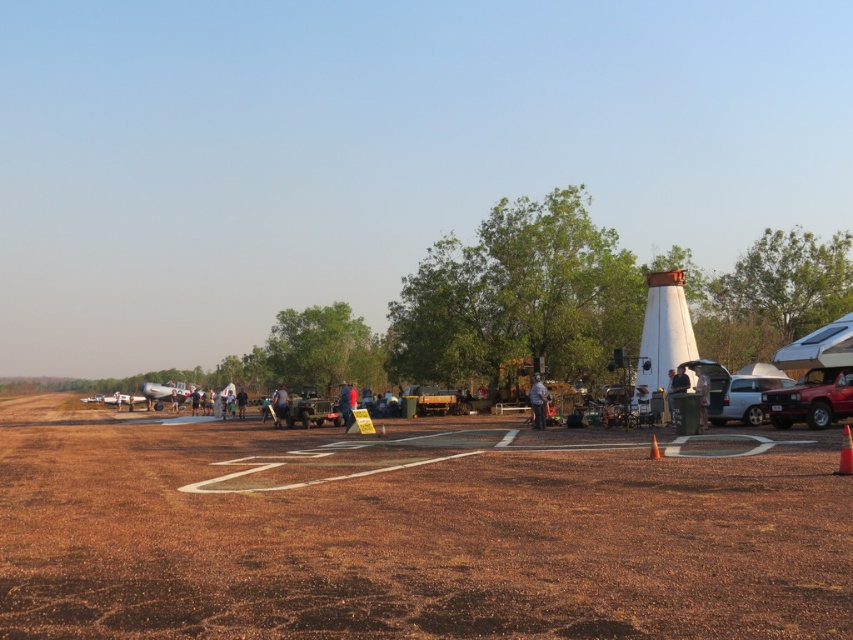
In the scene shown: You are a photographer setting up equipment at the airfield. You have two orange cones, the orange matte traffic cone at center and the orange cone at center. You need to choose the one that is wider to block a light beam. Which one should you pick?

The orange matte traffic cone at center is wider than orange cone at center, so you should pick the orange matte traffic cone at center to block the light beam.

You are standing at the center of the airfield and want to place a new sign exactly at the orange matte traffic cone at center. What are the coordinates where you should place the sign?

The orange matte traffic cone at center is located at coordinates point (845, 452), so you should place the sign there.